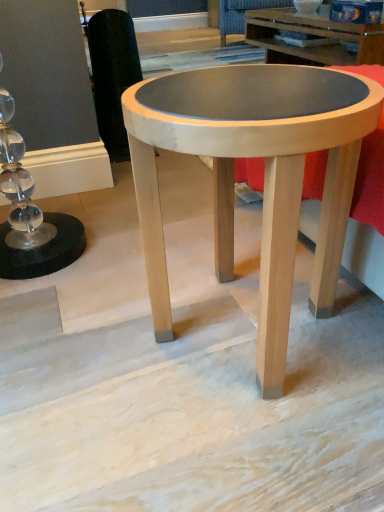
Question: From a real-world perspective, is velvet dark blue swivel chair at upper center, which appears as the second swivel chair when viewed from the front, positioned above or below matte wood coffee table at center?

Choices:
 (A) below
 (B) above

Answer: (A)

Question: Based on their positions, is velvet dark blue swivel chair at upper center, the 1th swivel chair when ordered from top to bottom, located to the left or right of matte wood coffee table at center?

Choices:
 (A) left
 (B) right

Answer: (B)

Question: Considering the real-world distances, which object is closest to the velvet dark blue swivel chair at upper center, the 1th swivel chair in the right-to-left sequence?

Choices:
 (A) matte wood coffee table at center
 (B) black fabric swivel chair at left, acting as the second swivel chair starting from the right

Answer: (B)

Question: Which of these objects is positioned farthest from the velvet dark blue swivel chair at upper center, acting as the second swivel chair starting from the bottom?

Choices:
 (A) matte wood coffee table at center
 (B) black fabric swivel chair at left, the 2th swivel chair in the back-to-front sequence

Answer: (A)